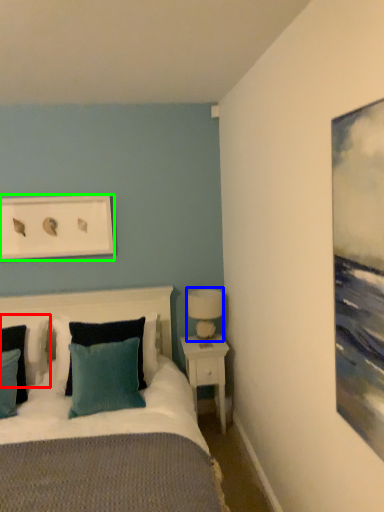
Question: Estimate the real-world distances between objects in this image. Which object is closer to pillow (highlighted by a red box), table lamp (highlighted by a blue box) or picture frame (highlighted by a green box)?

Choices:
 (A) table lamp
 (B) picture frame

Answer: (B)